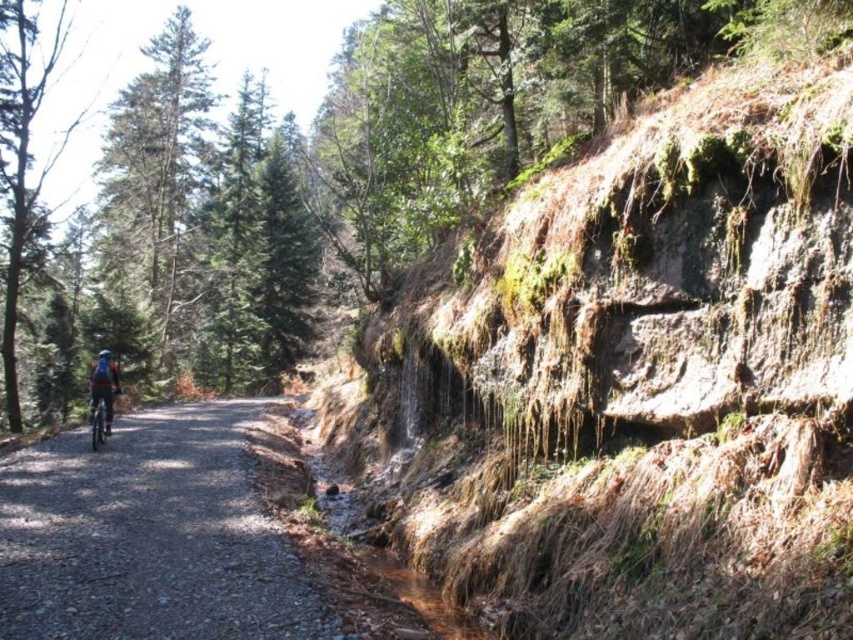
Question: Considering the real-world distances, which object is farthest from the rusty rock cliff at right?

Choices:
 (A) blue fabric backpack at center-left
 (B) blue matte helmet at left
 (C) gravelly dirt path at left

Answer: (B)

Question: Estimate the real-world distances between objects in this image. Which object is farther from the shiny blue bicycle at center?

Choices:
 (A) blue matte helmet at left
 (B) gravelly dirt path at left
 (C) green matte tree at left

Answer: (C)

Question: Among these points, which one is nearest to the camera?

Choices:
 (A) (109, 374)
 (B) (466, 284)
 (C) (33, 112)
 (D) (97, 356)

Answer: (B)

Question: Does gravelly dirt path at left appear under green matte tree at left?

Choices:
 (A) no
 (B) yes

Answer: (B)

Question: Can you confirm if shiny blue bicycle at center is wider than blue matte helmet at left?

Choices:
 (A) yes
 (B) no

Answer: (B)

Question: Is gravelly dirt path at left below shiny blue bicycle at center?

Choices:
 (A) yes
 (B) no

Answer: (A)